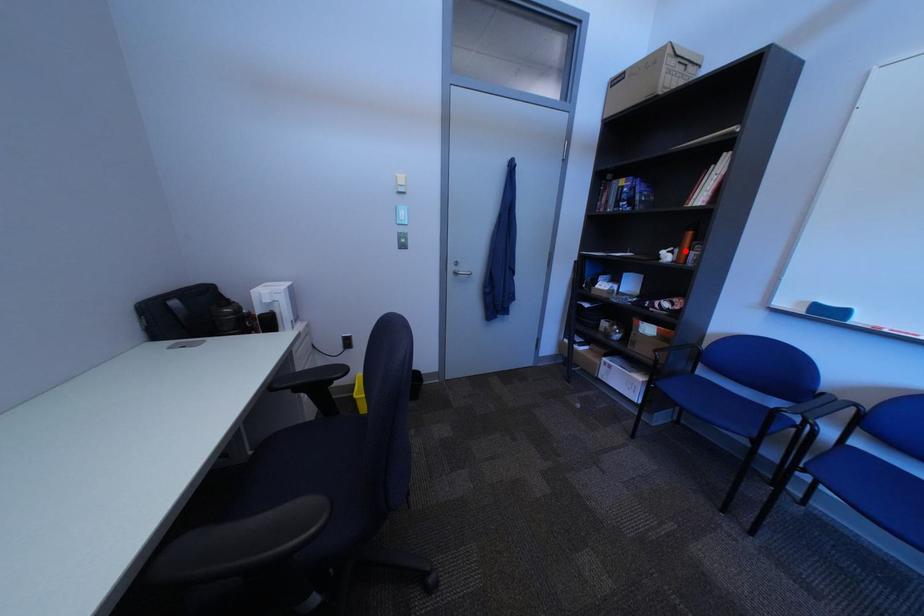
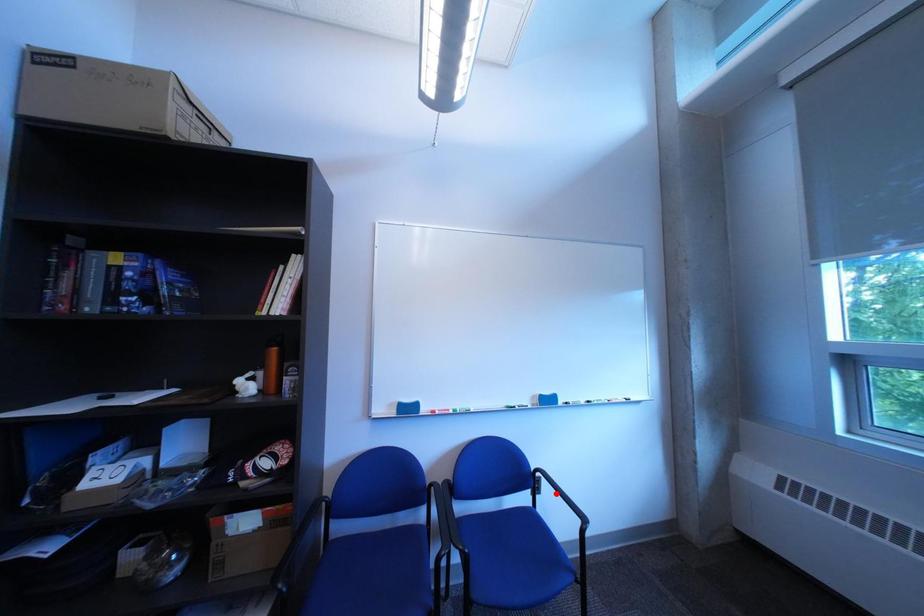
I am providing you with two images of the same scene from different viewpoints. A red point is marked on the first image and another point is marked on the second image. Is the red point in image1 aligned with the point shown in image2?

No